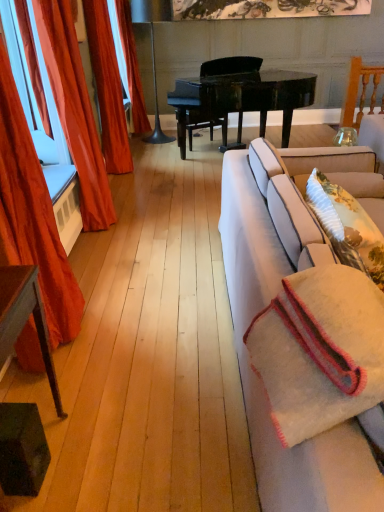
This screenshot has width=384, height=512. Identify the location of free location in front of velvet orange curtain at left, positioned as the fourth curtain in back-to-front order. (66, 393).